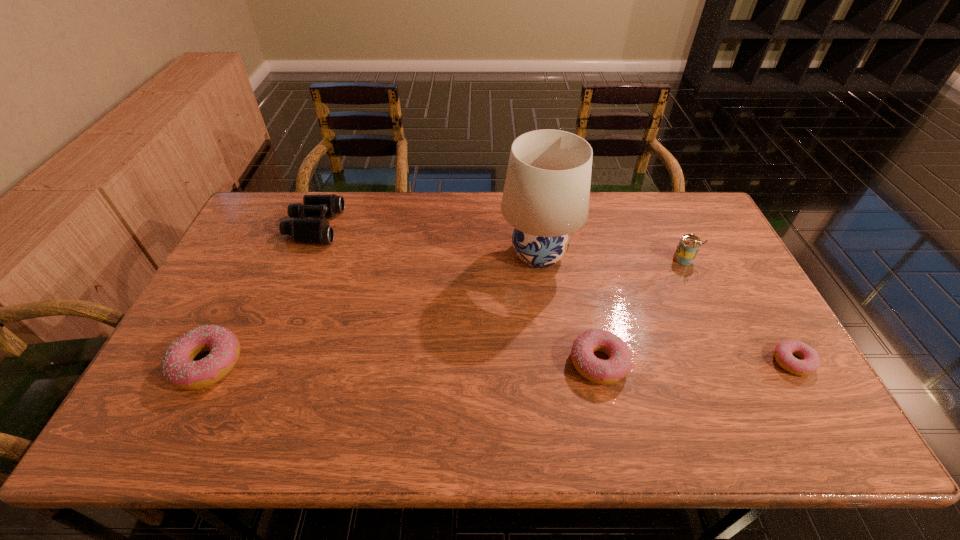
Identify the location of vacant space that satisfies the following two spatial constraints: 1. on the front-facing side of the fourth shortest object; 2. on the right side of the second doughnut from left to right. (258, 362).

Identify the location of free space in the image that satisfies the following two spatial constraints: 1. on the front-facing side of the binoculars; 2. on the left side of the second shortest object. (258, 362).

Locate an element on the screen. This screenshot has height=540, width=960. free location that satisfies the following two spatial constraints: 1. on the front-facing side of the can; 2. on the left side of the lampshade is located at coordinates (540, 259).

At what (x,y) coordinates should I click in order to perform the action: click on vacant point that satisfies the following two spatial constraints: 1. on the front-facing side of the tallest object; 2. on the right side of the fifth tallest object. Please return your answer as a coordinate pair (x, y). The width and height of the screenshot is (960, 540). Looking at the image, I should click on (553, 362).

You are a GUI agent. You are given a task and a screenshot of the screen. Output one action in this format:
    pyautogui.click(x=<x>, y=<y>)
    Task: Click on the vacant space that satisfies the following two spatial constraints: 1. on the front-facing side of the fourth shortest object; 2. on the back side of the rightmost doughnut
    This screenshot has height=540, width=960.
    Given the screenshot: What is the action you would take?
    pyautogui.click(x=258, y=362)

You are a GUI agent. You are given a task and a screenshot of the screen. Output one action in this format:
    pyautogui.click(x=<x>, y=<y>)
    Task: Click on the free location that satisfies the following two spatial constraints: 1. on the front-facing side of the binoculars; 2. on the back side of the can
    The image size is (960, 540).
    Given the screenshot: What is the action you would take?
    pyautogui.click(x=300, y=259)